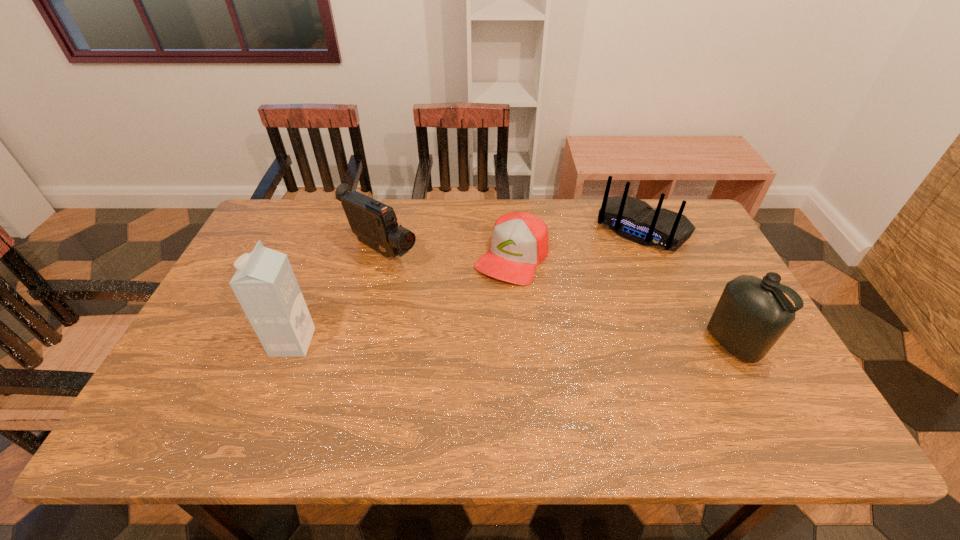
Identify the location of bottle located in the right edge section of the desktop. (752, 313).

Find the location of `router located at the right edge`. router located at the right edge is located at coordinates (635, 220).

The height and width of the screenshot is (540, 960). Identify the location of object positioned at the far right corner. click(635, 220).

The height and width of the screenshot is (540, 960). In the image, there is a desktop. Find the location of `vacant space at the far edge`. vacant space at the far edge is located at coordinates (603, 241).

Image resolution: width=960 pixels, height=540 pixels. In the image, there is a desktop. In order to click on vacant space at the near edge in this screenshot , I will do `click(267, 398)`.

Locate an element on the screen. Image resolution: width=960 pixels, height=540 pixels. vacant region at the left edge is located at coordinates tap(206, 330).

In the image, there is a desktop. Identify the location of vacant region at the right edge. (695, 271).

Image resolution: width=960 pixels, height=540 pixels. What are the coordinates of `vacant space at the far left corner` in the screenshot? It's located at (299, 201).

I want to click on vacant region at the near left corner, so click(x=216, y=378).

I want to click on vacant space at the far right corner of the desktop, so click(x=701, y=232).